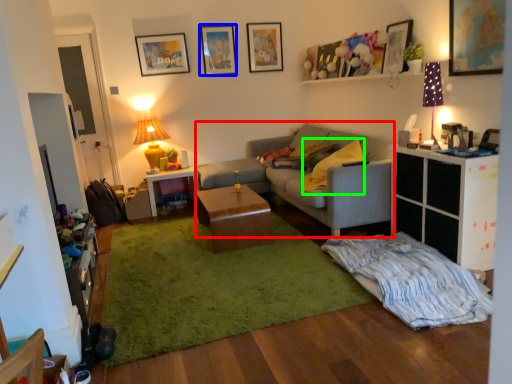
Question: Which object is the farthest from studio couch (highlighted by a red box)? Choose among these: picture frame (highlighted by a blue box) or pillow (highlighted by a green box).

Choices:
 (A) picture frame
 (B) pillow

Answer: (A)